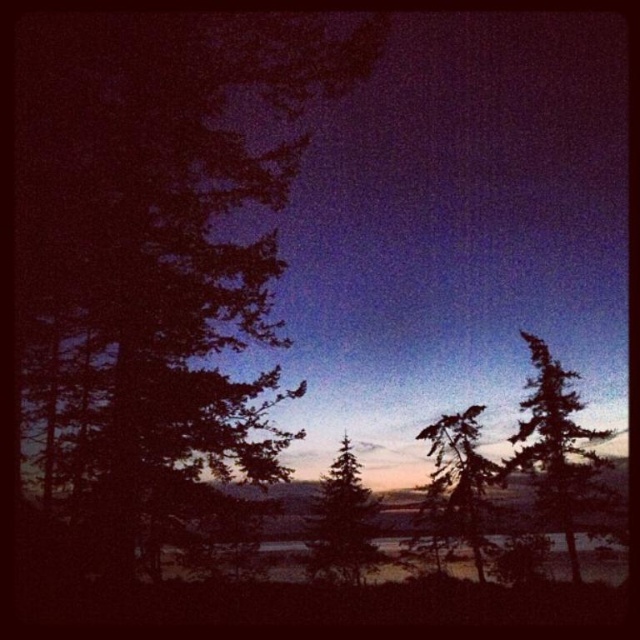
You are standing at the center of the scene and want to walk towards the green matte tree at right. In which general direction should you head?

The green matte tree at right is located at point 0.697 on the x and 0.872 on the y coordinate, so you should head towards the right and slightly upwards to reach it.